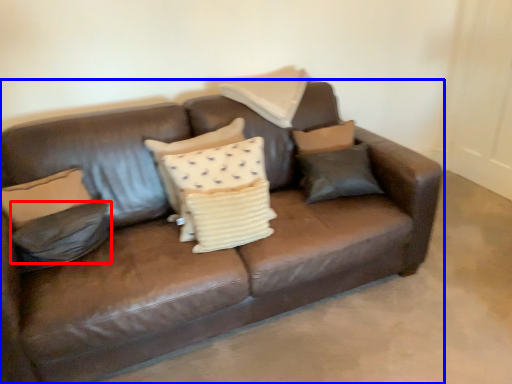
Question: Which point is further to the camera, pillow (highlighted by a red box) or studio couch (highlighted by a blue box)?

Choices:
 (A) pillow
 (B) studio couch

Answer: (A)